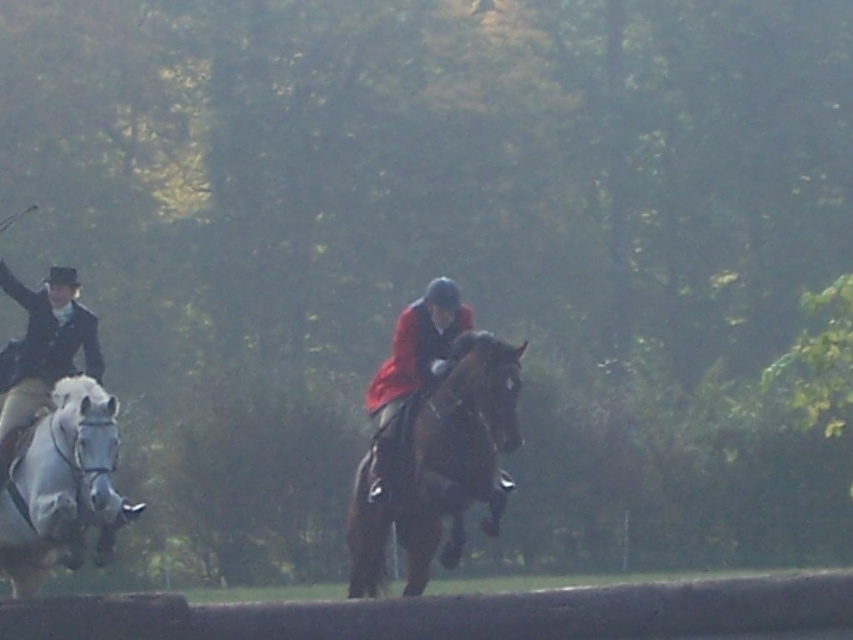
Who is shorter, shiny brown horse at center or white glossy horse at left?

white glossy horse at left is shorter.

Can you confirm if shiny brown horse at center is taller than white glossy horse at left?

Yes, shiny brown horse at center is taller than white glossy horse at left.

This screenshot has width=853, height=640. Find the location of `shiny brown horse at center`. shiny brown horse at center is located at coordinates (440, 465).

Consider the image. Is white glossy horse at left closer to camera compared to red velvet jacket at center?

Yes, white glossy horse at left is in front of red velvet jacket at center.

Between white glossy horse at left and red velvet jacket at center, which one has less height?

red velvet jacket at center is shorter.

Between point (109, 448) and point (370, 451), which one is positioned in front?

Point (109, 448) is more forward.

Find the location of a particular element. This screenshot has height=640, width=853. white glossy horse at left is located at coordinates (61, 484).

Between point (447, 449) and point (444, 321), which one is positioned behind?

Positioned behind is point (444, 321).

Between shiny brown horse at center and red velvet jacket at center, which one has less height?

red velvet jacket at center is shorter.

Describe the element at coordinates (440, 465) in the screenshot. I see `shiny brown horse at center` at that location.

The width and height of the screenshot is (853, 640). What are the coordinates of `shiny brown horse at center` in the screenshot? It's located at (440, 465).